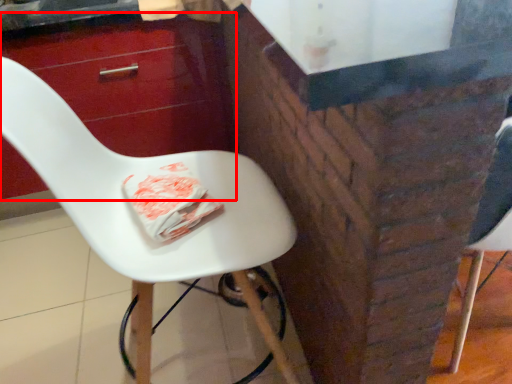
Question: In this image, where is drawer (annotated by the red box) located relative to chair?

Choices:
 (A) left
 (B) right

Answer: (A)